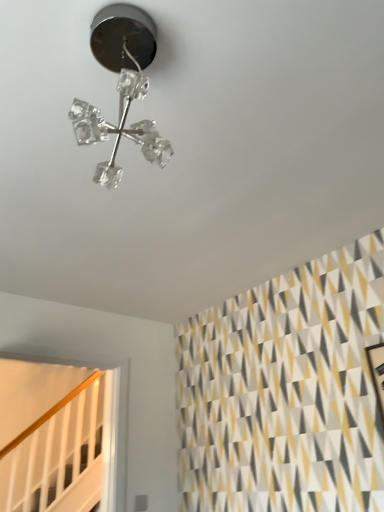
Question: Is white wooden stairwell at lower left closer to camera compared to clear crystal chandelier at upper center?

Choices:
 (A) yes
 (B) no

Answer: (B)

Question: Are white wooden stairwell at lower left and clear crystal chandelier at upper center far apart?

Choices:
 (A) no
 (B) yes

Answer: (B)

Question: Can you confirm if white wooden stairwell at lower left is smaller than clear crystal chandelier at upper center?

Choices:
 (A) no
 (B) yes

Answer: (A)

Question: Is white wooden stairwell at lower left completely or partially outside of clear crystal chandelier at upper center?

Choices:
 (A) yes
 (B) no

Answer: (A)

Question: Is the depth of white wooden stairwell at lower left greater than that of clear crystal chandelier at upper center?

Choices:
 (A) yes
 (B) no

Answer: (A)

Question: From a real-world perspective, is white wooden stairwell at lower left positioned over clear crystal chandelier at upper center based on gravity?

Choices:
 (A) no
 (B) yes

Answer: (A)

Question: Considering the relative sizes of clear crystal chandelier at upper center and white wooden stairwell at lower left in the image provided, is clear crystal chandelier at upper center shorter than white wooden stairwell at lower left?

Choices:
 (A) yes
 (B) no

Answer: (A)

Question: Could you tell me if clear crystal chandelier at upper center is facing white wooden stairwell at lower left?

Choices:
 (A) no
 (B) yes

Answer: (B)

Question: Is clear crystal chandelier at upper center closer to camera compared to white wooden stairwell at lower left?

Choices:
 (A) no
 (B) yes

Answer: (B)

Question: Would you say clear crystal chandelier at upper center is a long distance from white wooden stairwell at lower left?

Choices:
 (A) yes
 (B) no

Answer: (A)

Question: Considering the relative positions of clear crystal chandelier at upper center and white wooden stairwell at lower left in the image provided, is clear crystal chandelier at upper center to the left of white wooden stairwell at lower left from the viewer's perspective?

Choices:
 (A) no
 (B) yes

Answer: (A)

Question: Does clear crystal chandelier at upper center have a greater height compared to white wooden stairwell at lower left?

Choices:
 (A) yes
 (B) no

Answer: (B)

Question: Is clear crystal chandelier at upper center taller or shorter than white wooden stairwell at lower left?

Choices:
 (A) short
 (B) tall

Answer: (A)